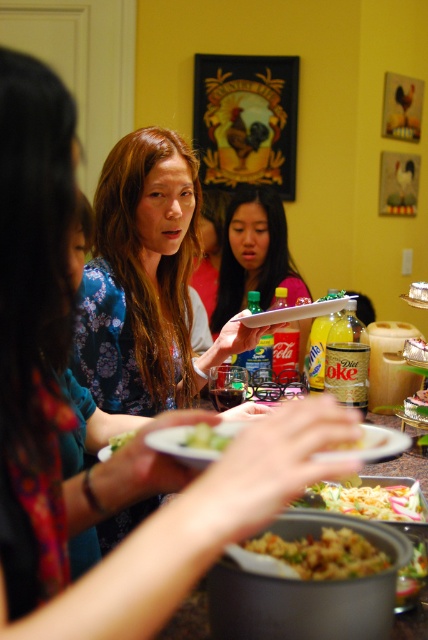
Question: Can you confirm if pink fabric shirt at center is positioned below green leafy vegetable at center?

Choices:
 (A) yes
 (B) no

Answer: (B)

Question: Can you confirm if pink fabric shirt at center is bigger than brown rice at center?

Choices:
 (A) yes
 (B) no

Answer: (A)

Question: Estimate the real-world distances between objects in this image. Which object is farther from the pink fabric shirt at center?

Choices:
 (A) shiny metallic spoon at center
 (B) green leafy salad at center

Answer: (A)

Question: Which of the following is the closest to the observer?

Choices:
 (A) (333, 504)
 (B) (118, 435)
 (C) (228, 252)
 (D) (398, 605)

Answer: (D)

Question: Does shiny metallic bowl at center appear under green leafy salad at center?

Choices:
 (A) no
 (B) yes

Answer: (B)

Question: Which point is closer to the camera?

Choices:
 (A) (350, 490)
 (B) (267, 268)
 (C) (407, 598)

Answer: (C)